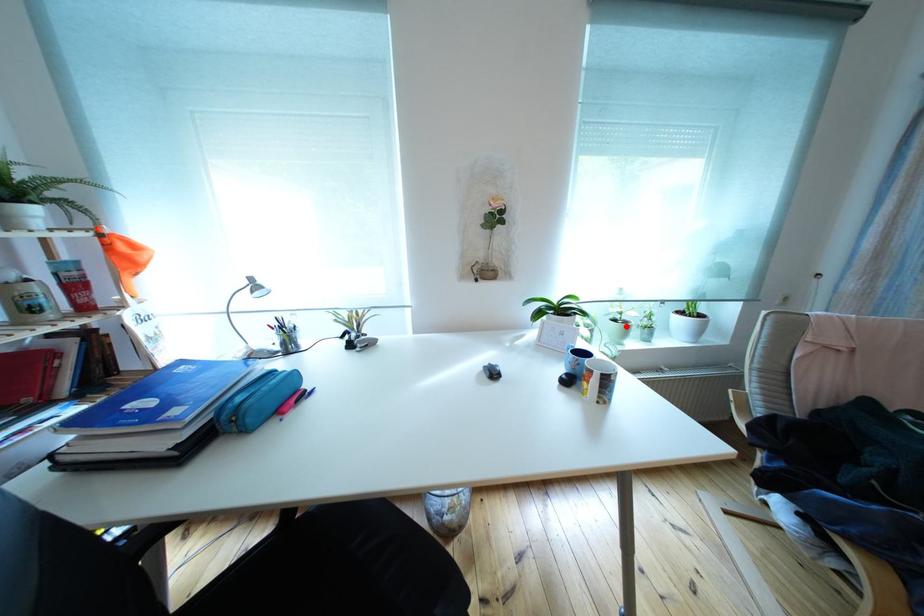
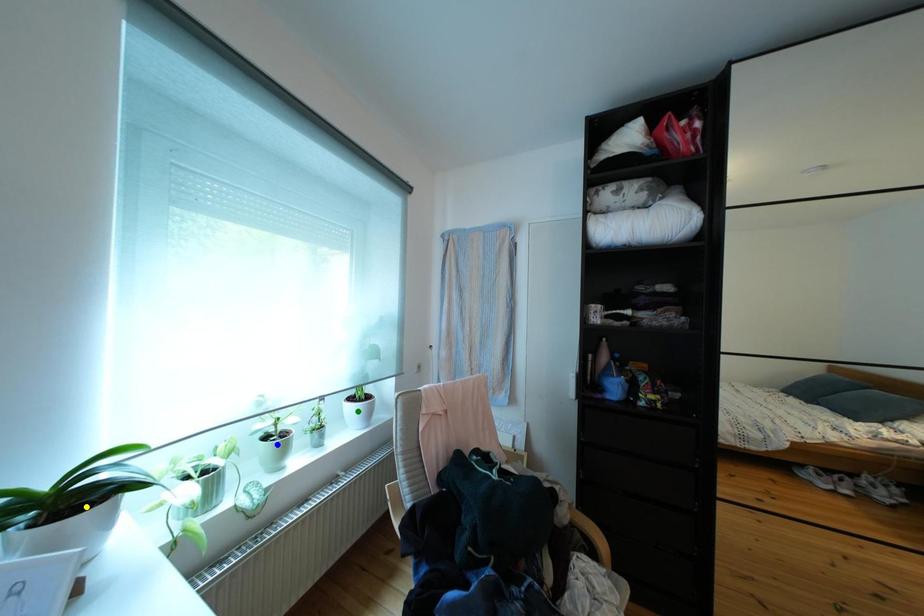
Question: I am providing you with two images of the same scene from different viewpoints. A red point is marked on the first image. You are given multiple points on the second image. Which spot in image 2 lines up with the point in image 1?

Choices:
 (A) yellow point
 (B) blue point
 (C) green point

Answer: (B)